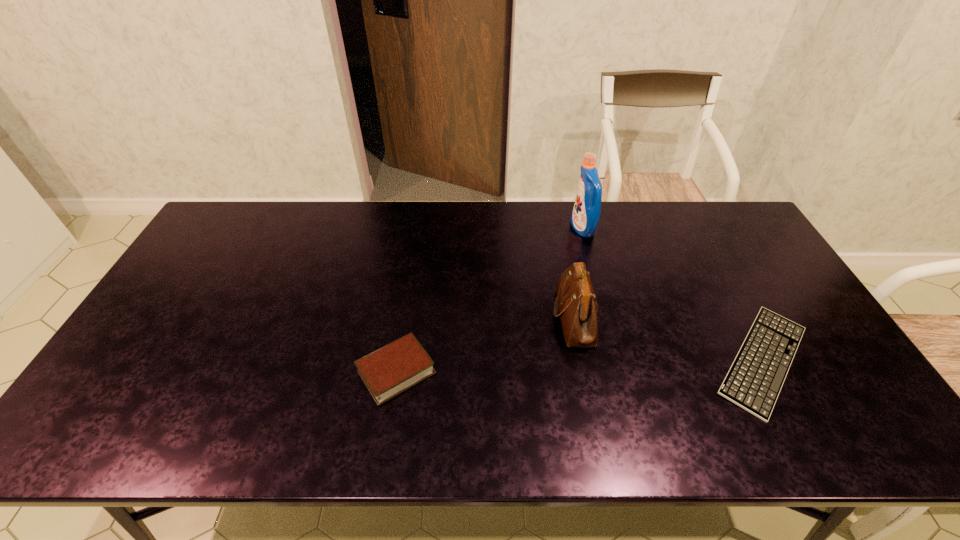
You are a GUI agent. You are given a task and a screenshot of the screen. Output one action in this format:
    pyautogui.click(x=<x>, y=<y>)
    Task: Click on the empty space between the farthest object and the Bible
    
    Given the screenshot: What is the action you would take?
    pyautogui.click(x=490, y=300)

This screenshot has width=960, height=540. Find the location of `vacant space in between the leftmost object and the shoulder bag`. vacant space in between the leftmost object and the shoulder bag is located at coordinates (486, 344).

Select which object is the third closest to the leftmost object. Please provide its 2D coordinates. Your answer should be formatted as a tuple, i.e. [(x, y)], where the tuple contains the x and y coordinates of a point satisfying the conditions above.

[(755, 378)]

Select which object appears as the closest to the Bible. Please provide its 2D coordinates. Your answer should be formatted as a tuple, i.e. [(x, y)], where the tuple contains the x and y coordinates of a point satisfying the conditions above.

[(575, 304)]

Where is `blank area in the image that satisfies the following two spatial constraints: 1. on the label of the shortest object; 2. on the right side of the detergent`? Image resolution: width=960 pixels, height=540 pixels. blank area in the image that satisfies the following two spatial constraints: 1. on the label of the shortest object; 2. on the right side of the detergent is located at coordinates (617, 360).

Identify the location of free space in the image that satisfies the following two spatial constraints: 1. on the back side of the shortest object; 2. on the label of the detergent. The image size is (960, 540). (692, 228).

This screenshot has height=540, width=960. What are the coordinates of `free location that satisfies the following two spatial constraints: 1. on the label of the tallest object; 2. on the front side of the shoulder bag` in the screenshot? It's located at (606, 316).

This screenshot has height=540, width=960. What are the coordinates of `free space that satisfies the following two spatial constraints: 1. on the label of the detergent; 2. on the front side of the shoulder bag` in the screenshot? It's located at (606, 316).

Locate an element on the screen. This screenshot has width=960, height=540. free location that satisfies the following two spatial constraints: 1. on the label of the tallest object; 2. on the back side of the computer keyboard is located at coordinates (617, 360).